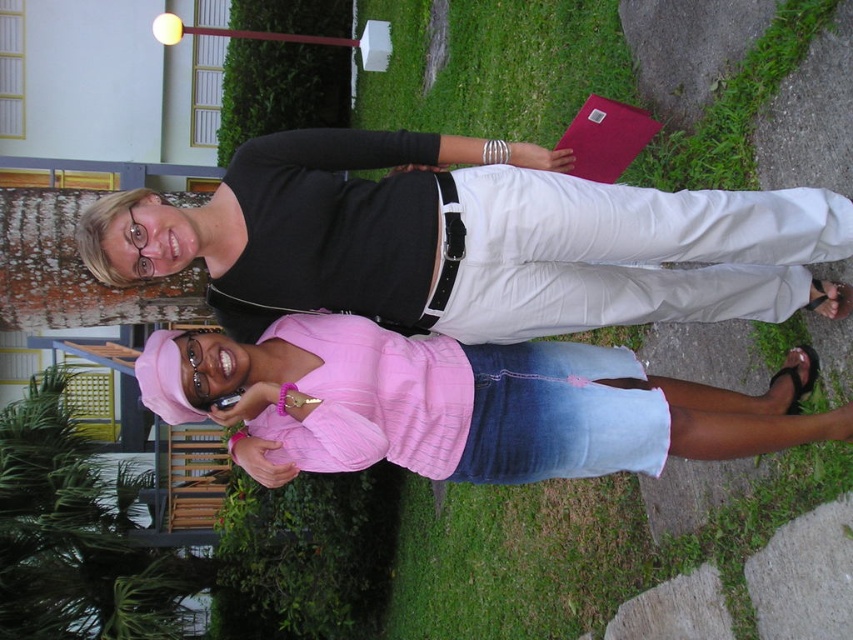
Question: Does matte black shirt at center have a larger size compared to pink fabric shirt at center?

Choices:
 (A) no
 (B) yes

Answer: (B)

Question: Among these points, which one is nearest to the camera?

Choices:
 (A) tap(228, 285)
 (B) tap(402, 432)

Answer: (B)

Question: From the image, what is the correct spatial relationship of matte black shirt at center in relation to pink fabric shirt at center?

Choices:
 (A) above
 (B) below

Answer: (A)

Question: Where is matte black shirt at center located in relation to pink fabric shirt at center in the image?

Choices:
 (A) left
 (B) right

Answer: (A)

Question: Which of the following is the farthest from the observer?

Choices:
 (A) pink fabric shirt at center
 (B) matte black shirt at center

Answer: (A)